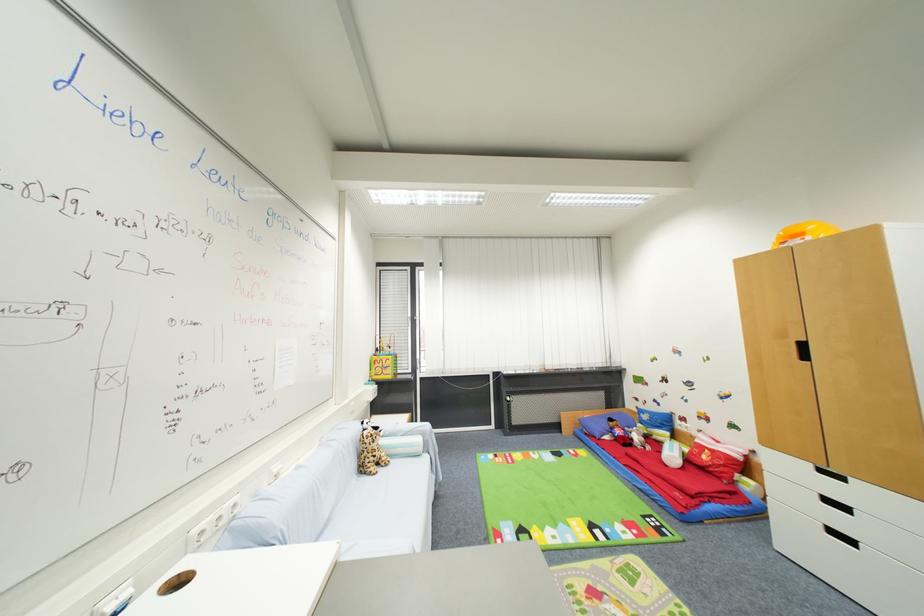
Where would you sit the sofa sitting surface? Please return your answer as a coordinate pair (x, y).

(381, 516)